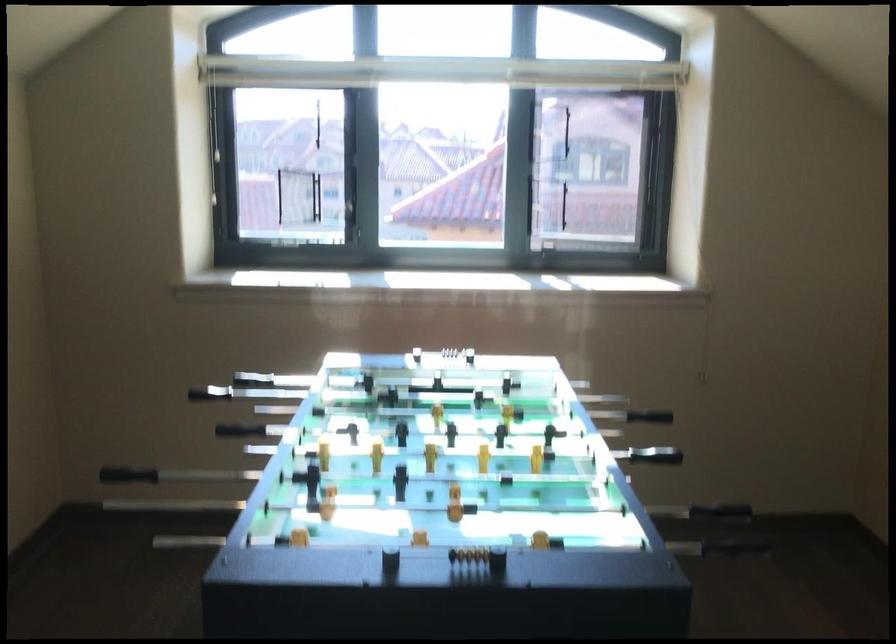
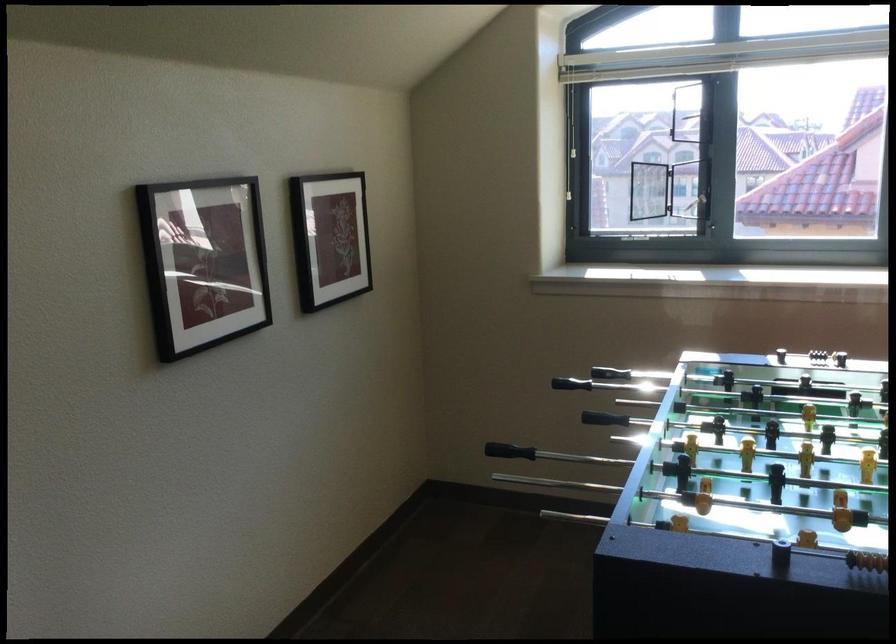
The point at (211, 399) is marked in the first image. Where is the corresponding point in the second image?

(570, 384)